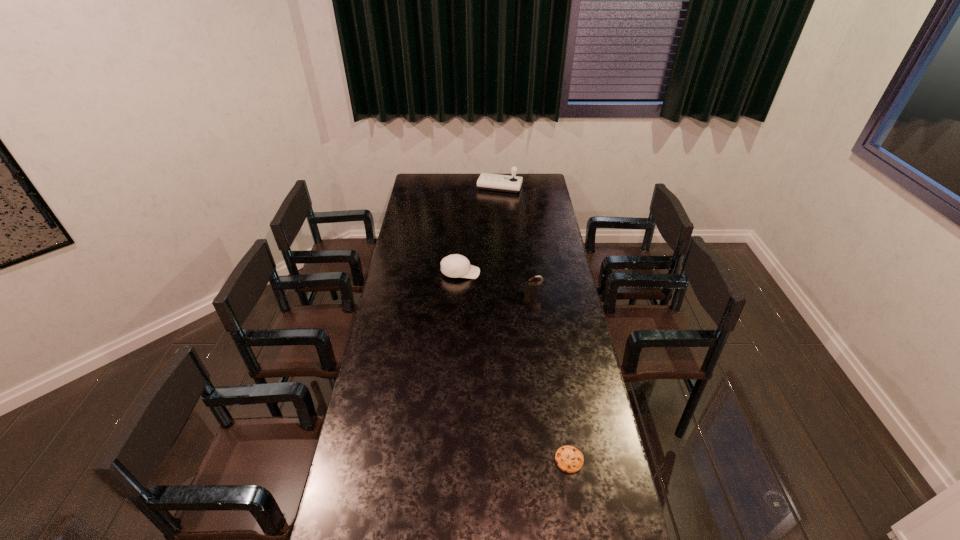
The height and width of the screenshot is (540, 960). I want to click on free space between the cookie and the padlock, so click(551, 376).

I want to click on free space that is in between the second farthest object and the shortest object, so click(515, 366).

Locate an element on the screen. vacant region between the farthest object and the nearest object is located at coordinates click(x=535, y=323).

Locate an element on the screen. The height and width of the screenshot is (540, 960). empty location between the cookie and the baseball cap is located at coordinates 515,366.

Find the location of a particular element. free space that is in between the second nearest object and the second farthest object is located at coordinates click(x=496, y=283).

Locate an element on the screen. free space that is in between the nearest object and the padlock is located at coordinates (551, 376).

Identify which object is the second nearest to the second nearest object. Please provide its 2D coordinates. Your answer should be formatted as a tuple, i.e. [(x, y)], where the tuple contains the x and y coordinates of a point satisfying the conditions above.

[(569, 459)]

Choose which object is the third nearest neighbor to the third farthest object. Please provide its 2D coordinates. Your answer should be formatted as a tuple, i.e. [(x, y)], where the tuple contains the x and y coordinates of a point satisfying the conditions above.

[(495, 182)]

At what (x,y) coordinates should I click in order to perform the action: click on free location that satisfies the following two spatial constraints: 1. on the front-facing side of the baseball cap; 2. on the back side of the shortest object. Please return your answer as a coordinate pair (x, y). This screenshot has height=540, width=960. Looking at the image, I should click on (451, 460).

Locate an element on the screen. free space that satisfies the following two spatial constraints: 1. on the front side of the tallest object; 2. on the front-facing side of the baseball cap is located at coordinates (506, 273).